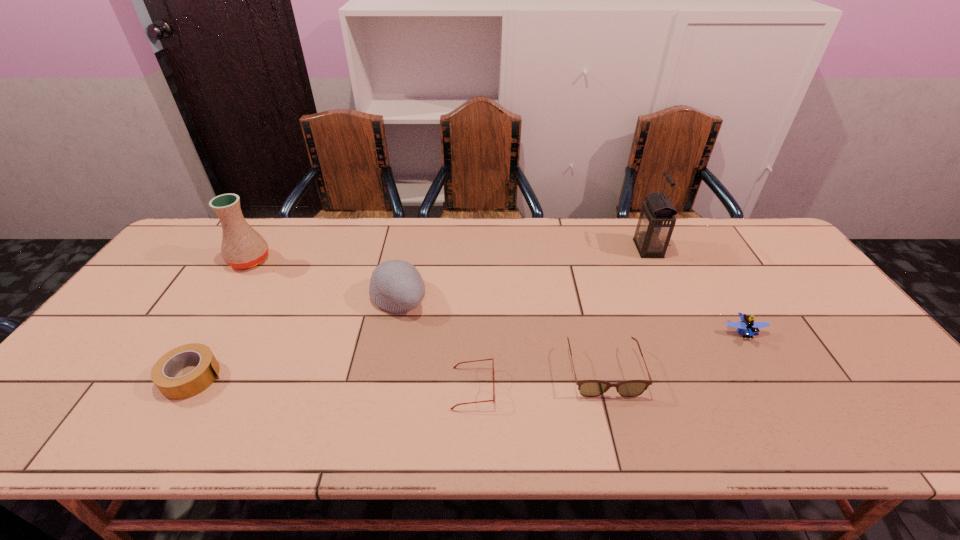
I want to click on lantern, so (x=657, y=219).

Find the location of a particular element. The image size is (960, 540). the second object from right to left is located at coordinates (657, 219).

Identify the location of pottery. (242, 247).

At what (x,y) coordinates should I click in order to perform the action: click on the fifth object from right to left. Please return your answer as a coordinate pair (x, y). The height and width of the screenshot is (540, 960). Looking at the image, I should click on (396, 286).

Identify the location of beanie. The width and height of the screenshot is (960, 540). (396, 286).

Where is `the rightmost object`? The height and width of the screenshot is (540, 960). the rightmost object is located at coordinates (747, 324).

The height and width of the screenshot is (540, 960). Find the location of `the right spectacles`. the right spectacles is located at coordinates (589, 388).

Locate an element on the screen. This screenshot has height=540, width=960. the taller spectacles is located at coordinates (589, 388).

Identify the location of duct tape. (166, 368).

Identify the location of the left spectacles. The width and height of the screenshot is (960, 540). (493, 400).